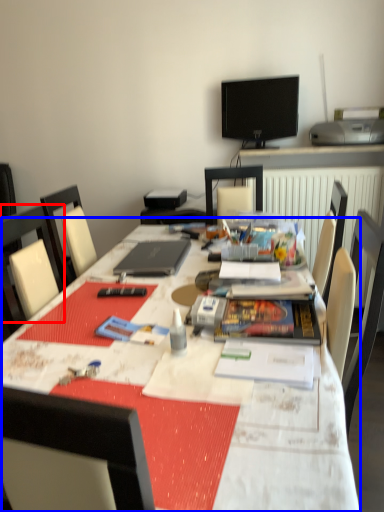
Question: Which point is closer to the camera, chair (highlighted by a red box) or table (highlighted by a blue box)?

Choices:
 (A) chair
 (B) table

Answer: (B)